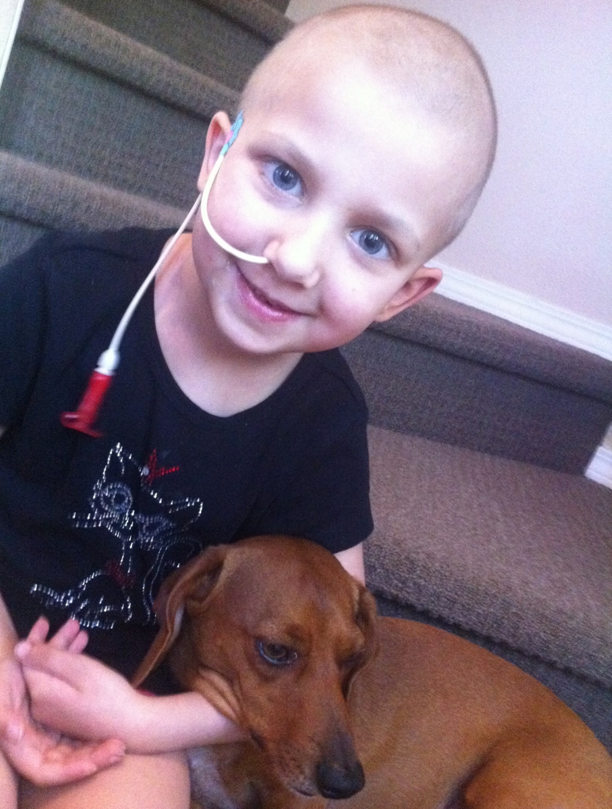
Find the location of a particular element. The image size is (612, 809). wall is located at coordinates (562, 143).